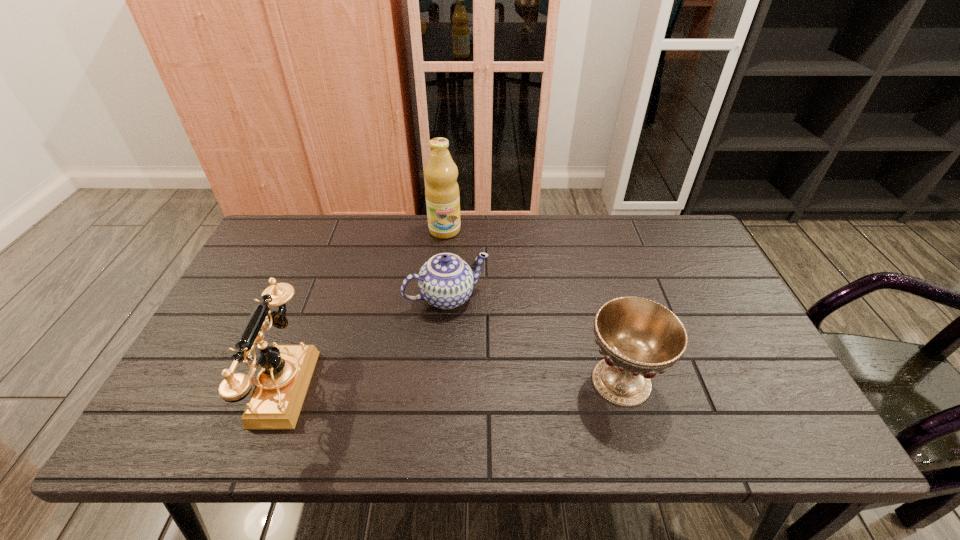
The height and width of the screenshot is (540, 960). In order to click on vacant area that lies between the third tallest object and the olive oil in this screenshot , I will do `click(533, 306)`.

Identify the location of vacant area between the leftmost object and the rightmost object. (451, 383).

This screenshot has width=960, height=540. In order to click on unoccupied area between the chalice and the tallest object in this screenshot , I will do coord(533,306).

The image size is (960, 540). Find the location of `free spot between the third shortest object and the olive oil`. free spot between the third shortest object and the olive oil is located at coordinates (363, 308).

Where is `the third closest object to the olive oil`? Image resolution: width=960 pixels, height=540 pixels. the third closest object to the olive oil is located at coordinates (638, 337).

Identify which object is located as the third nearest to the olive oil. Please provide its 2D coordinates. Your answer should be formatted as a tuple, i.e. [(x, y)], where the tuple contains the x and y coordinates of a point satisfying the conditions above.

[(638, 337)]

Where is `free location that satisfies the following two spatial constraints: 1. on the front side of the third nearest object; 2. on the right side of the second shortest object`? free location that satisfies the following two spatial constraints: 1. on the front side of the third nearest object; 2. on the right side of the second shortest object is located at coordinates (441, 381).